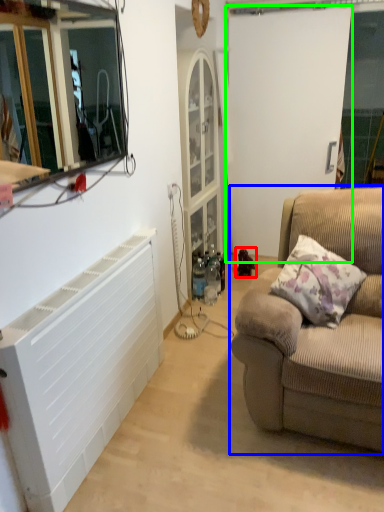
Question: Considering the real-world distances, which object is farthest from toy (highlighted by a red box)? studio couch (highlighted by a blue box) or screen door (highlighted by a green box)?

Choices:
 (A) studio couch
 (B) screen door

Answer: (A)